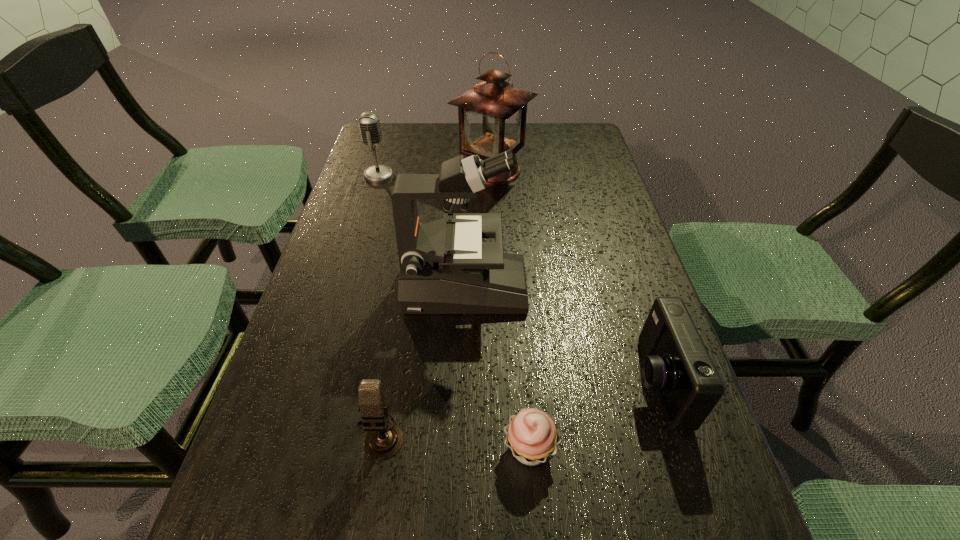
You are a GUI agent. You are given a task and a screenshot of the screen. Output one action in this format:
    pyautogui.click(x=<x>, y=<y>)
    Task: Click on the blank space at the left edge of the desktop
    
    Given the screenshot: What is the action you would take?
    pyautogui.click(x=371, y=234)

You are a GUI agent. You are given a task and a screenshot of the screen. Output one action in this format:
    pyautogui.click(x=<x>, y=<y>)
    Task: Click on the free location at the right edge
    
    Given the screenshot: What is the action you would take?
    pyautogui.click(x=678, y=434)

At what (x,y) coordinates should I click in order to perform the action: click on vacant position at the far right corner of the desktop. Please return your answer as a coordinate pair (x, y). This screenshot has width=960, height=540. Looking at the image, I should click on (591, 147).

Where is `free space between the camera and the cupcake`? free space between the camera and the cupcake is located at coordinates (593, 415).

In order to click on vacant region between the oil lamp and the leftmost object in this screenshot , I will do `click(435, 172)`.

You are a GUI agent. You are given a task and a screenshot of the screen. Output one action in this format:
    pyautogui.click(x=<x>, y=<y>)
    Task: Click on the free point between the left microphone and the nearer microphone
    This screenshot has width=960, height=540.
    Given the screenshot: What is the action you would take?
    pyautogui.click(x=379, y=305)

The width and height of the screenshot is (960, 540). I want to click on vacant area that lies between the shorter microphone and the rightmost object, so click(x=518, y=409).

I want to click on free point between the third farthest object and the rightmost object, so click(561, 335).

Where is `empty space that is in between the rightmost object and the microscope`? This screenshot has width=960, height=540. empty space that is in between the rightmost object and the microscope is located at coordinates (561, 335).

Locate an element on the screen. The image size is (960, 540). vacant space in between the rightmost object and the oil lamp is located at coordinates (574, 276).